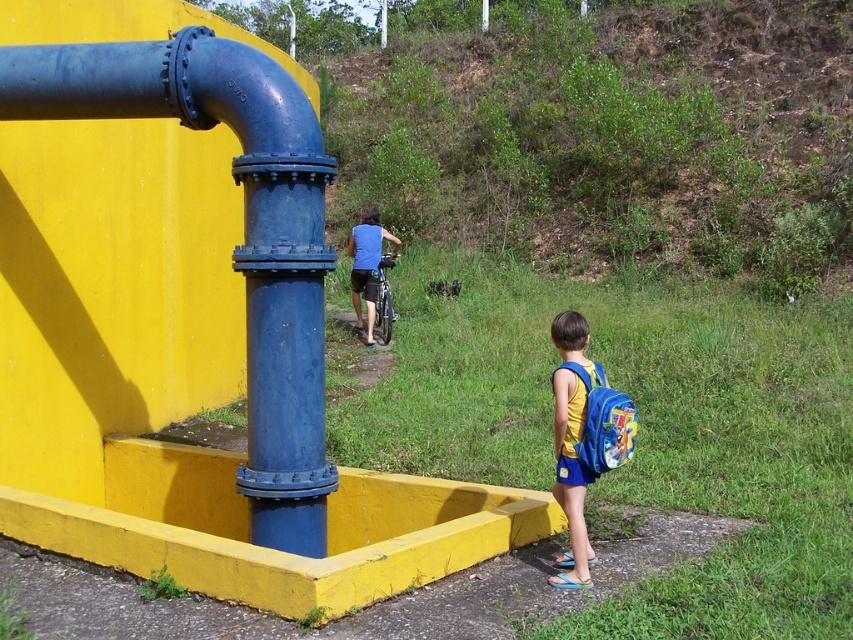
Who is more forward, (589, 360) or (373, 237)?

Positioned in front is point (589, 360).

Who is lower down, blue fabric backpack at center or blue matte shirt at center?

blue fabric backpack at center is lower down.

I want to click on blue fabric backpack at center, so click(x=570, y=476).

Looking at this image, is blue metallic pipe at left further to the viewer compared to blue fabric backpack at center?

Yes.

Based on the photo, does blue metallic pipe at left appear over blue fabric backpack at center?

Yes, blue metallic pipe at left is above blue fabric backpack at center.

The image size is (853, 640). What do you see at coordinates (244, 232) in the screenshot?
I see `blue metallic pipe at left` at bounding box center [244, 232].

At what (x,y) coordinates should I click in order to perform the action: click on blue metallic pipe at left. Please return your answer as a coordinate pair (x, y). Looking at the image, I should click on (244, 232).

Is blue metallic pipe at left bigger than blue matte shirt at center?

Correct, blue metallic pipe at left is larger in size than blue matte shirt at center.

Does blue metallic pipe at left appear on the right side of blue matte shirt at center?

In fact, blue metallic pipe at left is to the left of blue matte shirt at center.

The image size is (853, 640). I want to click on blue metallic pipe at left, so click(244, 232).

Image resolution: width=853 pixels, height=640 pixels. What are the coordinates of `blue metallic pipe at left` in the screenshot? It's located at (244, 232).